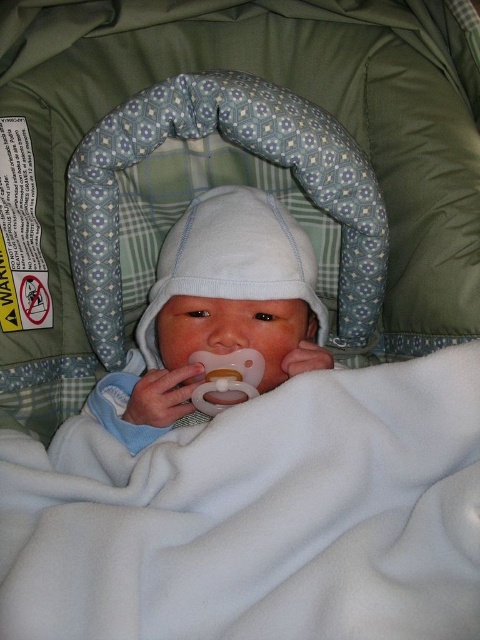
Question: In this image, where is white fleece blanket at center located relative to white soft baby at center?

Choices:
 (A) left
 (B) right

Answer: (B)

Question: Which point is farther to the camera?

Choices:
 (A) white soft baby at center
 (B) white fleece blanket at center

Answer: (A)

Question: Which of the following is the closest to the observer?

Choices:
 (A) white fleece blanket at center
 (B) white soft baby at center

Answer: (A)

Question: Considering the relative positions of white fleece blanket at center and white soft baby at center in the image provided, where is white fleece blanket at center located with respect to white soft baby at center?

Choices:
 (A) above
 (B) below

Answer: (B)

Question: Which point is farther to the camera?

Choices:
 (A) white fleece blanket at center
 (B) white soft baby at center

Answer: (B)

Question: From the image, what is the correct spatial relationship of white fleece blanket at center in relation to white soft baby at center?

Choices:
 (A) right
 (B) left

Answer: (A)